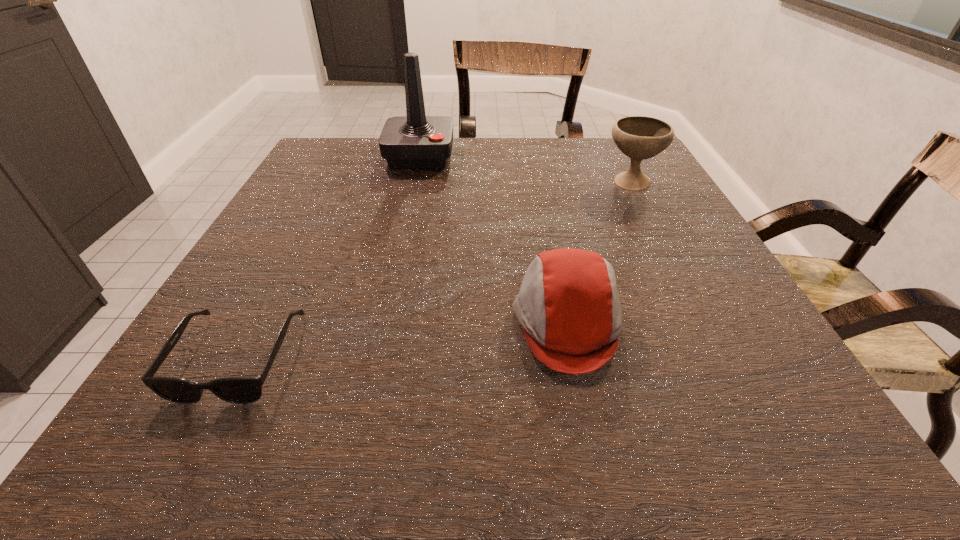
The image size is (960, 540). Find the location of `the third object from right to left`. the third object from right to left is located at coordinates (416, 141).

Image resolution: width=960 pixels, height=540 pixels. In order to click on joystick in this screenshot , I will do `click(416, 141)`.

I want to click on the rightmost object, so click(x=638, y=137).

The width and height of the screenshot is (960, 540). What are the coordinates of `chalice` in the screenshot? It's located at (638, 137).

Where is `the second object from right to left`? The width and height of the screenshot is (960, 540). the second object from right to left is located at coordinates (x=568, y=306).

This screenshot has width=960, height=540. I want to click on the second shortest object, so click(x=568, y=306).

Where is `sunglasses`? This screenshot has height=540, width=960. sunglasses is located at coordinates (241, 390).

The width and height of the screenshot is (960, 540). I want to click on the shortest object, so click(241, 390).

Image resolution: width=960 pixels, height=540 pixels. In order to click on free space located 0.150m on the right of the joystick in this screenshot , I will do `click(511, 156)`.

Identify the location of free space located 0.390m on the front of the chalice. Image resolution: width=960 pixels, height=540 pixels. (703, 323).